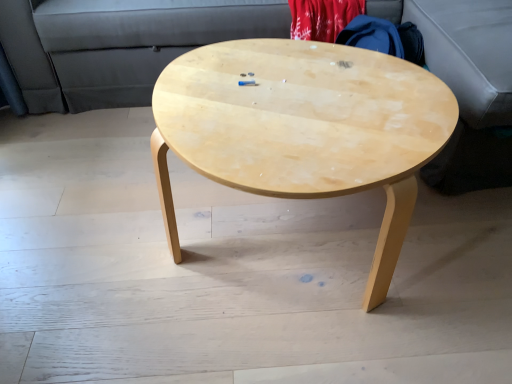
Locate an element on the screen. Image resolution: width=512 pixels, height=384 pixels. matte gray couch at upper center is located at coordinates (117, 44).

This screenshot has width=512, height=384. Describe the element at coordinates (117, 44) in the screenshot. I see `matte gray couch at upper center` at that location.

The image size is (512, 384). Identify the location of natural wood coffee table at center. (303, 128).

Describe the element at coordinates (303, 128) in the screenshot. The width and height of the screenshot is (512, 384). I see `natural wood coffee table at center` at that location.

Locate an element on the screen. matte gray couch at upper center is located at coordinates (117, 44).

Which is more to the right, natural wood coffee table at center or matte gray couch at upper center?

From the viewer's perspective, natural wood coffee table at center appears more on the right side.

Is natural wood coffee table at center in front of matte gray couch at upper center?

Yes, it is.

Does point (243, 151) lie behind point (487, 88)?

No, (243, 151) is in front of (487, 88).

From the image's perspective, is natural wood coffee table at center below matte gray couch at upper center?

Yes, from the image's perspective, natural wood coffee table at center is below matte gray couch at upper center.

From a real-world perspective, is natural wood coffee table at center below matte gray couch at upper center?

Correct, in the physical world, natural wood coffee table at center is lower than matte gray couch at upper center.

Considering the sizes of natural wood coffee table at center and matte gray couch at upper center in the image, is natural wood coffee table at center wider or thinner than matte gray couch at upper center?

In the image, natural wood coffee table at center appears to be more narrow than matte gray couch at upper center.

Looking at this image, who is taller, natural wood coffee table at center or matte gray couch at upper center?

matte gray couch at upper center.

Considering the sizes of natural wood coffee table at center and matte gray couch at upper center in the image, is natural wood coffee table at center bigger or smaller than matte gray couch at upper center?

natural wood coffee table at center is smaller than matte gray couch at upper center.

Would you say matte gray couch at upper center is part of natural wood coffee table at center's contents?

That's incorrect, matte gray couch at upper center is not inside natural wood coffee table at center.

Is natural wood coffee table at center directly adjacent to matte gray couch at upper center?

No, natural wood coffee table at center is not beside matte gray couch at upper center.

Is natural wood coffee table at center turned away from matte gray couch at upper center?

Yes, natural wood coffee table at center's orientation is away from matte gray couch at upper center.

The height and width of the screenshot is (384, 512). Identify the location of coffee table that is below the matte gray couch at upper center (from the image's perspective). (303, 128).

Which object is positioned more to the right, matte gray couch at upper center or natural wood coffee table at center?

natural wood coffee table at center.

Is the depth of matte gray couch at upper center greater than that of natural wood coffee table at center?

Yes, matte gray couch at upper center is further from the camera.

Which is nearer, (175, 50) or (393, 64)?

Positioned in front is point (393, 64).

From the image's perspective, relative to natural wood coffee table at center, is matte gray couch at upper center above or below?

Based on their image positions, matte gray couch at upper center is located above natural wood coffee table at center.

Based on the photo, from a real-world perspective, between matte gray couch at upper center and natural wood coffee table at center, who is vertically higher?

In real-world perspective, matte gray couch at upper center is above.

Which object is wider, matte gray couch at upper center or natural wood coffee table at center?

With larger width is matte gray couch at upper center.

Between matte gray couch at upper center and natural wood coffee table at center, which one has less height?

natural wood coffee table at center is shorter.

Can you confirm if matte gray couch at upper center is bigger than natural wood coffee table at center?

Yes, matte gray couch at upper center is bigger than natural wood coffee table at center.

Is natural wood coffee table at center a part of matte gray couch at upper center?

No, matte gray couch at upper center does not contain natural wood coffee table at center.

Are matte gray couch at upper center and natural wood coffee table at center far apart?

They are positioned close to each other.

Based on the photo, is matte gray couch at upper center positioned with its back to natural wood coffee table at center?

No, matte gray couch at upper center's orientation is not away from natural wood coffee table at center.

How far apart are matte gray couch at upper center and natural wood coffee table at center?

matte gray couch at upper center is 29.66 inches away from natural wood coffee table at center.

Identify the location of coffee table on the right of matte gray couch at upper center. (303, 128).

Locate an element on the screen. The width and height of the screenshot is (512, 384). couch behind the natural wood coffee table at center is located at coordinates (117, 44).

I want to click on couch above the natural wood coffee table at center (from a real-world perspective), so click(117, 44).